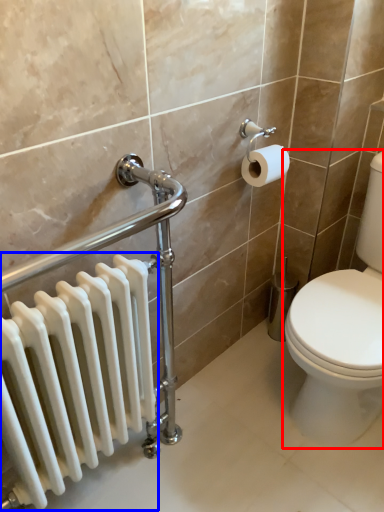
Question: Which point is closer to the camera, toilet (highlighted by a red box) or radiator (highlighted by a blue box)?

Choices:
 (A) toilet
 (B) radiator

Answer: (B)